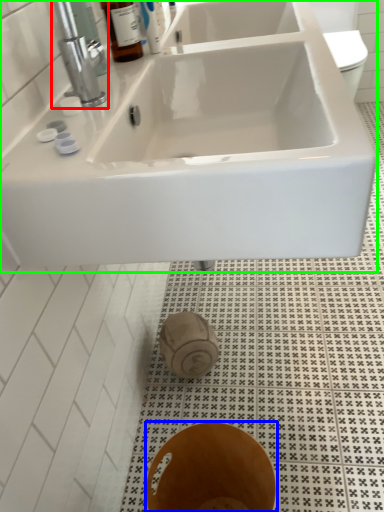
Question: Which object is the farthest from tap (highlighted by a red box)? Choose among these: bidet (highlighted by a blue box) or sink (highlighted by a green box).

Choices:
 (A) bidet
 (B) sink

Answer: (A)